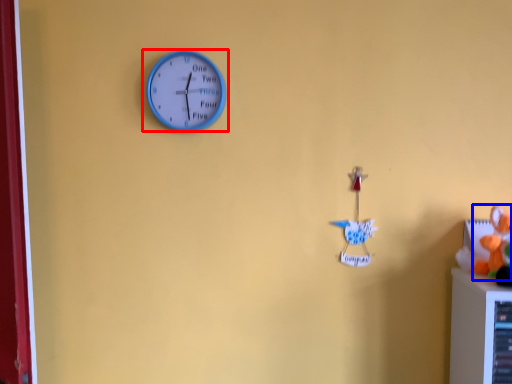
Question: Which of the following is the farthest to the observer, wall clock (highlighted by a red box) or toy (highlighted by a blue box)?

Choices:
 (A) wall clock
 (B) toy

Answer: (A)